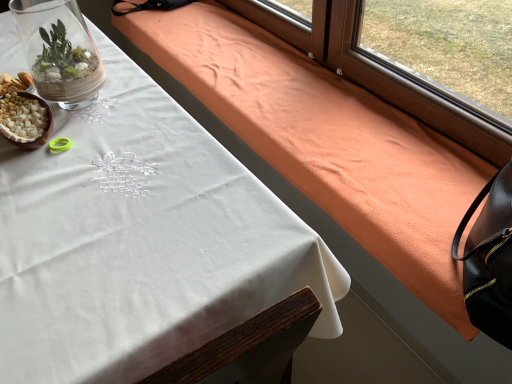
Question: Is the surface of white matte bowl at lower left in direct contact with white cloth at upper left?

Choices:
 (A) yes
 (B) no

Answer: (B)

Question: Can white cloth at upper left be found inside white matte bowl at lower left?

Choices:
 (A) no
 (B) yes

Answer: (A)

Question: From a real-world perspective, does white matte bowl at lower left sit lower than white cloth at upper left?

Choices:
 (A) no
 (B) yes

Answer: (A)

Question: Is white matte bowl at lower left not within white cloth at upper left?

Choices:
 (A) no
 (B) yes

Answer: (B)

Question: Does white matte bowl at lower left have a greater height compared to white cloth at upper left?

Choices:
 (A) yes
 (B) no

Answer: (B)

Question: From a real-world perspective, is white matte bowl at lower left positioned above or below white cloth at upper left?

Choices:
 (A) above
 (B) below

Answer: (A)

Question: Considering the positions of white matte bowl at lower left and white cloth at upper left in the image, is white matte bowl at lower left bigger or smaller than white cloth at upper left?

Choices:
 (A) small
 (B) big

Answer: (A)

Question: From the image's perspective, is white matte bowl at lower left above or below white cloth at upper left?

Choices:
 (A) below
 (B) above

Answer: (B)

Question: Is white matte bowl at lower left wider or thinner than white cloth at upper left?

Choices:
 (A) wide
 (B) thin

Answer: (B)

Question: Which is correct: clear glass terrarium at upper left is inside white cloth at upper left, or outside of it?

Choices:
 (A) outside
 (B) inside

Answer: (A)

Question: From a real-world perspective, is clear glass terrarium at upper left above or below white cloth at upper left?

Choices:
 (A) below
 (B) above

Answer: (B)

Question: In terms of height, does clear glass terrarium at upper left look taller or shorter compared to white cloth at upper left?

Choices:
 (A) short
 (B) tall

Answer: (A)

Question: From the image's perspective, is clear glass terrarium at upper left located above or below white cloth at upper left?

Choices:
 (A) below
 (B) above

Answer: (B)

Question: From a real-world perspective, is white matte bowl at lower left physically located above or below clear glass terrarium at upper left?

Choices:
 (A) below
 (B) above

Answer: (A)

Question: In terms of height, does white matte bowl at lower left look taller or shorter compared to clear glass terrarium at upper left?

Choices:
 (A) short
 (B) tall

Answer: (A)